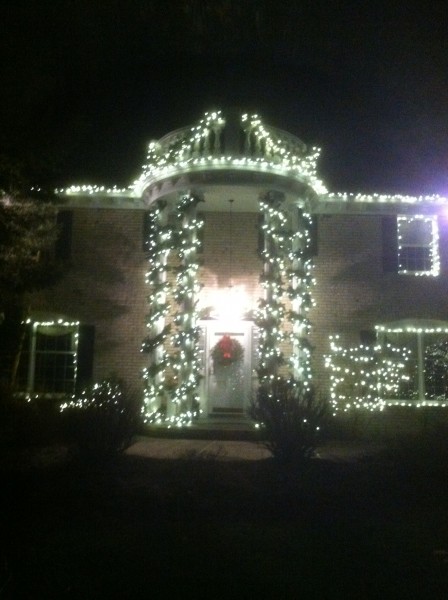
Identify the location of wreath. The image size is (448, 600). (225, 360).